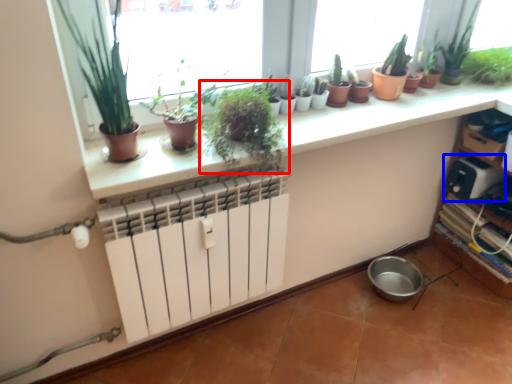
Question: Which of the following is the farthest to the observer, houseplant (highlighted by a red box) or appliance (highlighted by a blue box)?

Choices:
 (A) houseplant
 (B) appliance

Answer: (B)